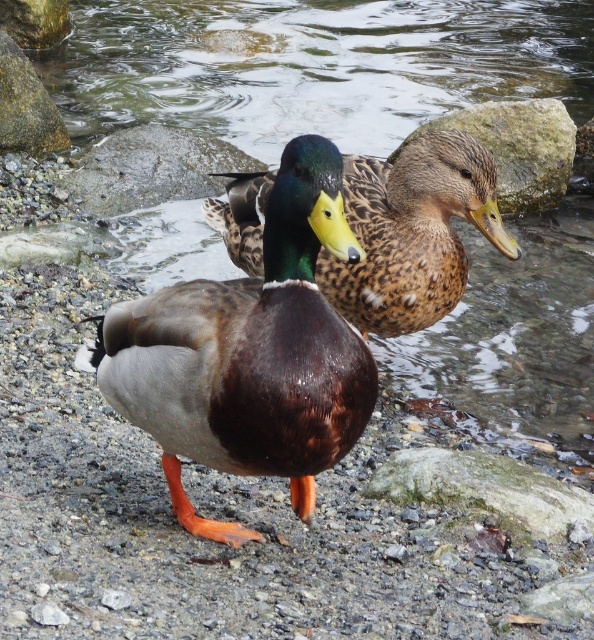
You are a photographer trying to capture both the brown matte duck at center and the shiny brown duck at center in a single shot. Which duck is closer to you, requiring you to adjust your focus to ensure both are in clear view?

The brown matte duck at center is closer to you, so you should focus on it first to ensure both ducks are in clear view.

You are a birdwatcher observing the ducks in the image. You notice two ducks at the center. Which duck is closer to you, the brown matte duck at center or the brown speckled duck at center?

The brown matte duck at center is closer to you because it is further to the viewer than the brown speckled duck at center.